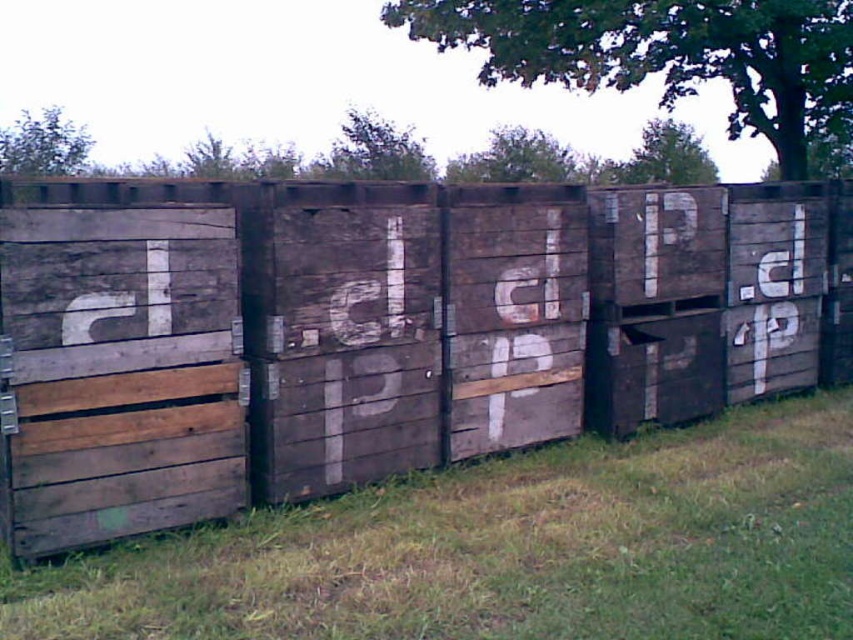
Is point (80, 230) less distant than point (648, 547)?

That is True.

Which of these two, weathered wood crates at center or green grass at lower center, stands taller?

With more height is weathered wood crates at center.

Does point (196, 326) lie in front of point (608, 532)?

Yes, point (196, 326) is closer to viewer.

At what (x,y) coordinates should I click in order to perform the action: click on weathered wood crates at center. Please return your answer as a coordinate pair (x, y). Looking at the image, I should click on (387, 330).